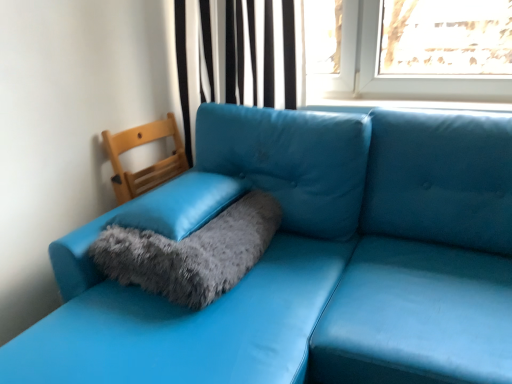
What do you see at coordinates (234, 56) in the screenshot? I see `black striped curtain at upper center` at bounding box center [234, 56].

Find the location of a particular element. fuzzy gray pillow at center is located at coordinates (181, 204).

Where is `matte blue leather couch at lower left`? Image resolution: width=512 pixels, height=384 pixels. matte blue leather couch at lower left is located at coordinates (314, 262).

Does black striped curtain at upper center come in front of wooden chair at left?

No, black striped curtain at upper center is further to the viewer.

Is black striped curtain at upper center facing towards wooden chair at left?

Yes, black striped curtain at upper center is turned towards wooden chair at left.

Between black striped curtain at upper center and wooden chair at left, which one has smaller size?

wooden chair at left is smaller.

Is black striped curtain at upper center beside wooden chair at left?

black striped curtain at upper center and wooden chair at left are clearly separated.

From the image's perspective, would you say matte blue leather couch at lower left is positioned over fuzzy gray cat bed at center?

Actually, matte blue leather couch at lower left appears below fuzzy gray cat bed at center in the image.

Is matte blue leather couch at lower left placed right next to fuzzy gray cat bed at center?

They are not placed beside each other.

Measure the distance from matte blue leather couch at lower left to fuzzy gray cat bed at center.

They are 9.23 inches apart.

Looking at this image, is matte blue leather couch at lower left at the right side of fuzzy gray cat bed at center?

Incorrect, matte blue leather couch at lower left is not on the right side of fuzzy gray cat bed at center.

Looking at this image, which is less distant, [154,134] or [285,7]?

Point [154,134] is farther from the camera than point [285,7].

Find the location of a particular element. armchair that is below the black striped curtain at upper center (from the image's perspective) is located at coordinates (147, 167).

Considering the sizes of objects wooden chair at left and black striped curtain at upper center in the image provided, who is wider, wooden chair at left or black striped curtain at upper center?

Wider between the two is black striped curtain at upper center.

Based on the photo, looking at the image, does wooden chair at left seem bigger or smaller compared to black striped curtain at upper center?

Considering their sizes, wooden chair at left takes up less space than black striped curtain at upper center.

You are a GUI agent. You are given a task and a screenshot of the screen. Output one action in this format:
    pyautogui.click(x=<x>, y=<y>)
    Task: Click on the curtain lying on the right of fuzzy gray cat bed at center
    The height and width of the screenshot is (384, 512).
    Given the screenshot: What is the action you would take?
    pyautogui.click(x=234, y=56)

Considering the positions of objects fuzzy gray cat bed at center and black striped curtain at upper center in the image provided, who is more to the right, fuzzy gray cat bed at center or black striped curtain at upper center?

black striped curtain at upper center.

Is point (256, 201) closer or farther from the camera than point (201, 5)?

Point (256, 201) is closer to the camera than point (201, 5).

Is fuzzy gray cat bed at center in front of or behind black striped curtain at upper center in the image?

Visually, fuzzy gray cat bed at center is located in front of black striped curtain at upper center.

Is fuzzy gray pillow at center taller or shorter than black striped curtain at upper center?

Considering their sizes, fuzzy gray pillow at center has less height than black striped curtain at upper center.

Is fuzzy gray pillow at center bigger than black striped curtain at upper center?

Incorrect, fuzzy gray pillow at center is not larger than black striped curtain at upper center.

Which is more distant, (163, 203) or (279, 97)?

The point (279, 97) is farther from the camera.

From the image's perspective, is fuzzy gray pillow at center located beneath black striped curtain at upper center?

Yes, from the image's perspective, fuzzy gray pillow at center is beneath black striped curtain at upper center.

From the image's perspective, is fuzzy gray pillow at center located beneath wooden chair at left?

Correct, fuzzy gray pillow at center appears lower than wooden chair at left in the image.

Is there a large distance between fuzzy gray pillow at center and wooden chair at left?

That's not correct — fuzzy gray pillow at center is a little close to wooden chair at left.

How different are the orientations of fuzzy gray pillow at center and wooden chair at left in degrees?

The angle between the facing direction of fuzzy gray pillow at center and the facing direction of wooden chair at left is 92.1 degrees.

Considering the relative positions of wooden chair at left and matte blue leather couch at lower left in the image provided, is wooden chair at left to the left of matte blue leather couch at lower left from the viewer's perspective?

Yes, wooden chair at left is to the left of matte blue leather couch at lower left.

Is wooden chair at left oriented towards matte blue leather couch at lower left?

Yes, wooden chair at left is aimed at matte blue leather couch at lower left.

At what (x,y) coordinates should I click in order to perform the action: click on studio couch below the wooden chair at left (from a real-world perspective). Please return your answer as a coordinate pair (x, y). Looking at the image, I should click on (314, 262).

Considering the relative sizes of wooden chair at left and matte blue leather couch at lower left in the image provided, is wooden chair at left bigger than matte blue leather couch at lower left?

No.

Image resolution: width=512 pixels, height=384 pixels. What are the coordinates of `curtain located above the wooden chair at left (from the image's perspective)` in the screenshot? It's located at (234, 56).

Locate an element on the screen. This screenshot has width=512, height=384. studio couch in front of the fuzzy gray cat bed at center is located at coordinates (314, 262).

Looking at the image, which one is located further to black striped curtain at upper center, wooden chair at left or fuzzy gray cat bed at center?

fuzzy gray cat bed at center.

Estimate the real-world distances between objects in this image. Which object is further from fuzzy gray pillow at center, wooden chair at left or black striped curtain at upper center?

black striped curtain at upper center.

Which object lies further to the anchor point fuzzy gray cat bed at center, wooden chair at left or black striped curtain at upper center?

The object further to fuzzy gray cat bed at center is black striped curtain at upper center.

Looking at the image, which one is located further to wooden chair at left, matte blue leather couch at lower left or fuzzy gray pillow at center?

Among the two, matte blue leather couch at lower left is located further to wooden chair at left.

Considering their positions, is wooden chair at left positioned closer to fuzzy gray pillow at center than matte blue leather couch at lower left?

The object closer to fuzzy gray pillow at center is matte blue leather couch at lower left.

From the image, which object appears to be nearer to fuzzy gray pillow at center, black striped curtain at upper center or wooden chair at left?

wooden chair at left.

Which object lies nearer to the anchor point black striped curtain at upper center, fuzzy gray pillow at center or fuzzy gray cat bed at center?

fuzzy gray pillow at center is closer to black striped curtain at upper center.

In the scene shown: Based on their spatial positions, is black striped curtain at upper center or fuzzy gray pillow at center closer to fuzzy gray cat bed at center?

Among the two, fuzzy gray pillow at center is located nearer to fuzzy gray cat bed at center.

Where is `armchair positioned between matte blue leather couch at lower left and black striped curtain at upper center from near to far`? The image size is (512, 384). armchair positioned between matte blue leather couch at lower left and black striped curtain at upper center from near to far is located at coordinates (147, 167).

Where is `cat bed between matte blue leather couch at lower left and wooden chair at left along the z-axis`? This screenshot has height=384, width=512. cat bed between matte blue leather couch at lower left and wooden chair at left along the z-axis is located at coordinates (192, 253).

This screenshot has height=384, width=512. I want to click on pillow positioned between matte blue leather couch at lower left and wooden chair at left from near to far, so click(181, 204).

Find the location of a particular element. The image size is (512, 384). cat bed positioned between matte blue leather couch at lower left and black striped curtain at upper center from near to far is located at coordinates (192, 253).